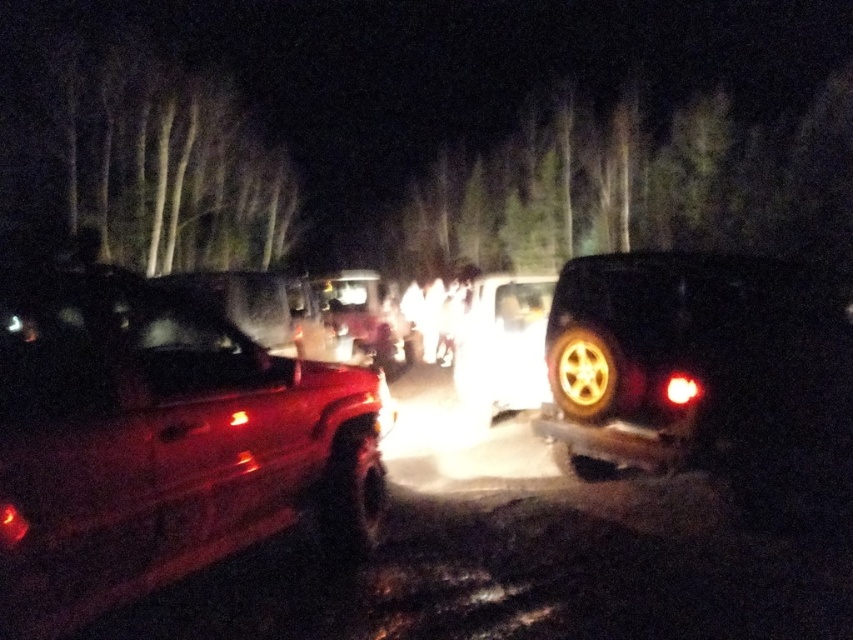
Question: Does matte red truck at left have a lesser width compared to matte black suv at right?

Choices:
 (A) yes
 (B) no

Answer: (A)

Question: Does rubber/textured tire at center come behind shiny metallic tire at right?

Choices:
 (A) yes
 (B) no

Answer: (B)

Question: Which of the following is the closest to the observer?

Choices:
 (A) (727, 390)
 (B) (575, 420)
 (C) (229, 433)

Answer: (C)

Question: Which point is closer to the camera taking this photo?

Choices:
 (A) (271, 380)
 (B) (691, 364)
 (C) (317, 506)
 (D) (595, 396)

Answer: (A)

Question: Among these points, which one is farthest from the camera?

Choices:
 (A) (56, 486)
 (B) (320, 496)
 (C) (610, 404)
 (D) (735, 444)

Answer: (C)

Question: Is matte red truck at left to the left of shiny metallic tire at right from the viewer's perspective?

Choices:
 (A) no
 (B) yes

Answer: (B)